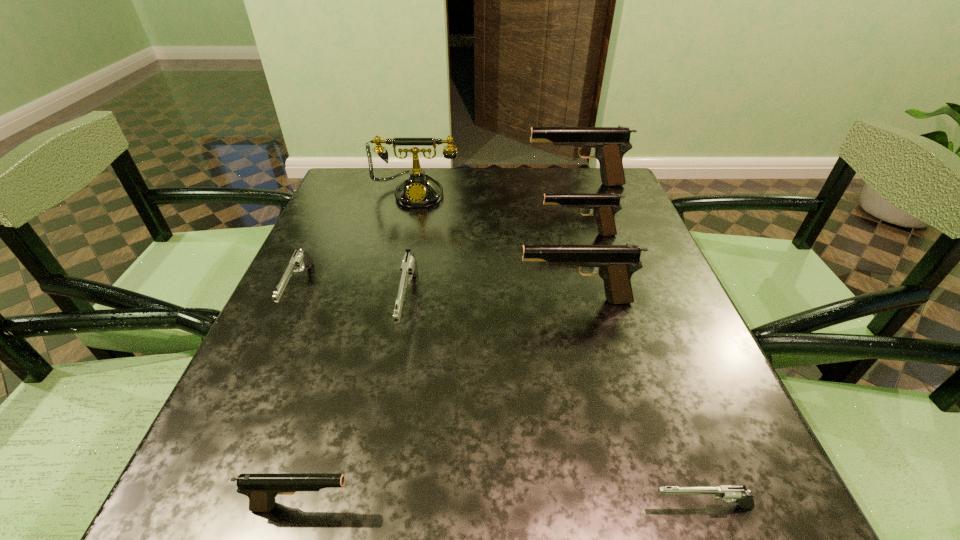
Locate which silver pistol ranks third in proximity to the tallest pistol. Please provide its 2D coordinates. Your answer should be formatted as a tuple, i.e. [(x, y)], where the tuple contains the x and y coordinates of a point satisfying the conditions above.

[(728, 493)]

Locate an element on the screen. vacant space that satisfies the following two spatial constraints: 1. at the muzzle of the third biggest black pistol; 2. on the front-facing side of the third pistol from left to right is located at coordinates (598, 306).

Identify the location of vacant space that satisfies the following two spatial constraints: 1. at the muzzle of the third farthest object; 2. on the front-facing side of the leftmost pistol. This screenshot has height=540, width=960. (594, 291).

Identify the location of free location that satisfies the following two spatial constraints: 1. at the muzzle of the third farthest object; 2. on the front-facing side of the leftmost object. This screenshot has height=540, width=960. (594, 291).

You are a GUI agent. You are given a task and a screenshot of the screen. Output one action in this format:
    pyautogui.click(x=<x>, y=<y>)
    Task: Click on the free spot that satisfies the following two spatial constraints: 1. at the muzzle of the third tallest pistol; 2. on the front-facing side of the second smallest silver pistol
    
    Given the screenshot: What is the action you would take?
    pyautogui.click(x=594, y=291)

The width and height of the screenshot is (960, 540). Find the location of `free region that satisfies the following two spatial constraints: 1. at the muzzle of the second nearest black pistol; 2. on the front-facing side of the second silver pistol from right to left`. free region that satisfies the following two spatial constraints: 1. at the muzzle of the second nearest black pistol; 2. on the front-facing side of the second silver pistol from right to left is located at coordinates (577, 306).